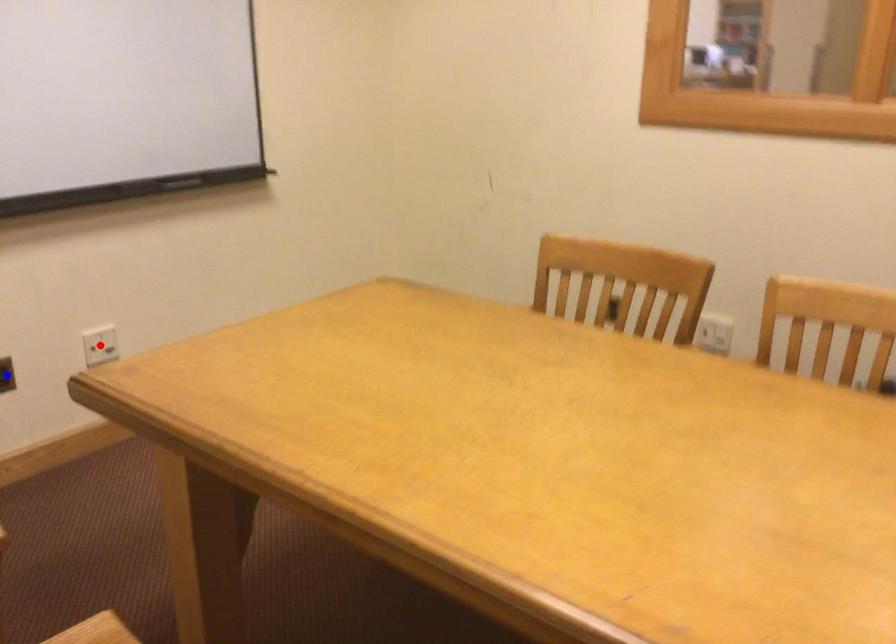
Question: Two points are marked on the image. Which point is closer to the camera?

Choices:
 (A) Blue point is closer.
 (B) Red point is closer.

Answer: (A)